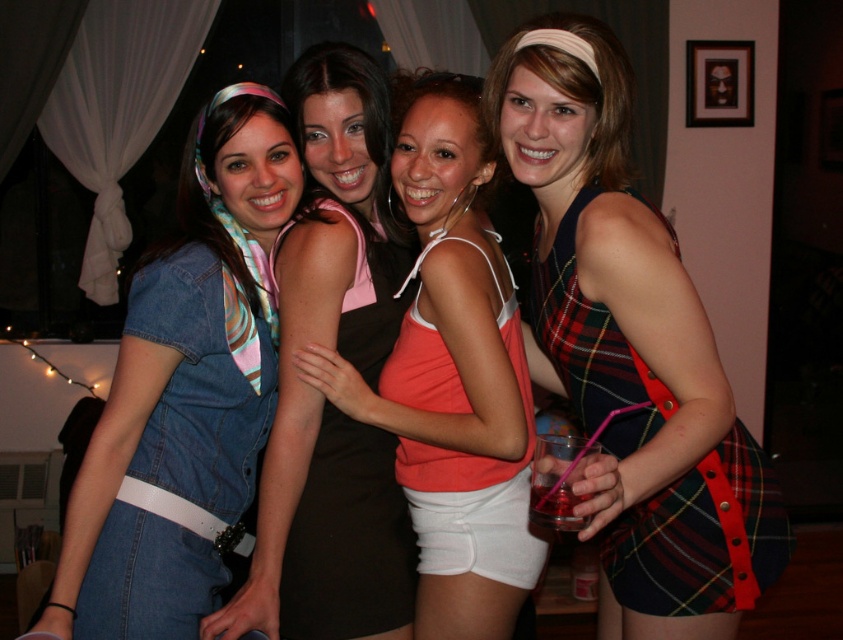
Question: Which of the following is the farthest from the observer?

Choices:
 (A) (272, 352)
 (B) (663, 600)
 (C) (422, 152)

Answer: (A)

Question: Which of these objects is positioned closest to the black satin dress at center?

Choices:
 (A) plaid fabric dress at right
 (B) denim dress at left

Answer: (B)

Question: From the image, what is the correct spatial relationship of denim dress at left in relation to plaid fabric dress at right?

Choices:
 (A) right
 (B) left

Answer: (B)

Question: Can you confirm if orange cotton tank top at center is bigger than black satin dress at center?

Choices:
 (A) yes
 (B) no

Answer: (A)

Question: Does denim vest at center appear on the left side of orange cotton tank top at center?

Choices:
 (A) no
 (B) yes

Answer: (B)

Question: Which object is farther from the camera taking this photo?

Choices:
 (A) denim vest at center
 (B) denim dress at left
 (C) orange cotton tank top at center

Answer: (C)